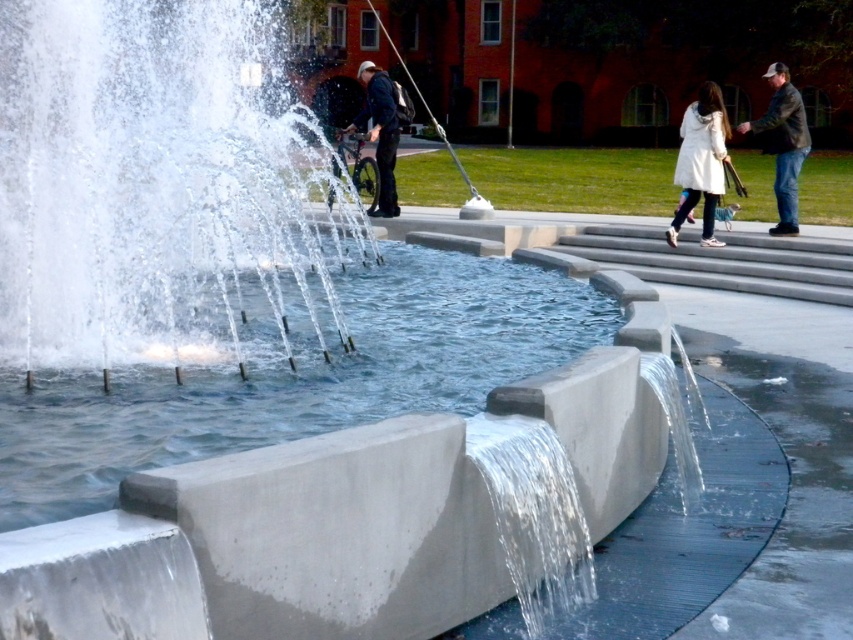
You are standing at the edge of the clear concrete water at center and want to place the dark brown leather jacket at upper right on a rack that is 1.2 meters tall. Can the jacket be placed without exceeding the rack height?

The clear concrete water at center has a lesser height compared to dark brown leather jacket at upper right, which means the jacket is taller than 1.2 meters. Therefore, the jacket cannot be placed on the rack without exceeding the rack height.

You are standing in the public space and see the clear concrete water at center and the dark brown leather jacket at upper right. Which object is located to the left of the other?

The clear concrete water at center is positioned on the left side of dark brown leather jacket at upper right.

You are standing at the entrance of the red brick building and want to reach the clear concrete water at center. Based on the coordinates provided, in which direction should you walk to get there?

The clear concrete water at center is located at coordinates point (294, 378). Since you are at the entrance of the red brick building, which is in the background, you should walk towards the center of the image to reach it.